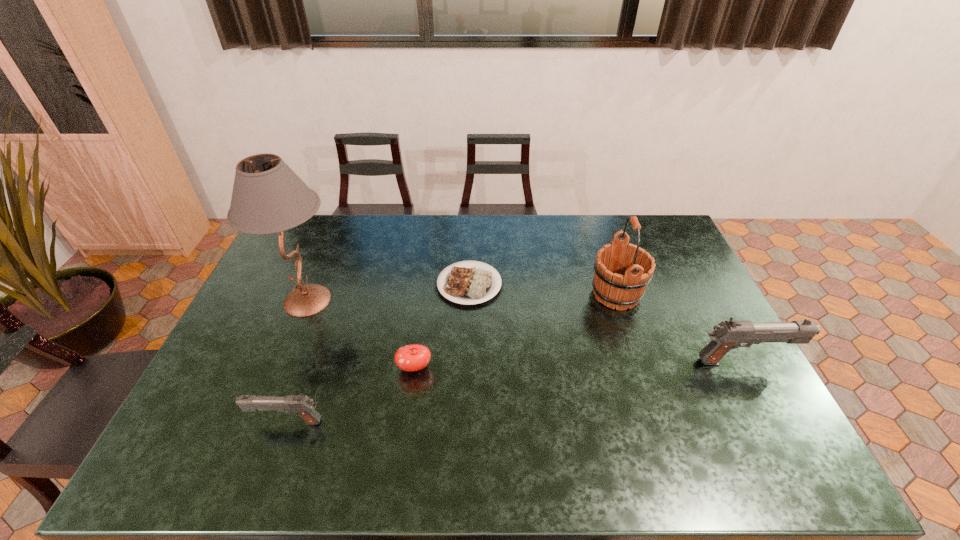
This screenshot has width=960, height=540. I want to click on vacant area that lies between the nearest object and the farther gun, so click(516, 392).

Locate an element on the screen. unoccupied position between the right gun and the shortest object is located at coordinates (607, 323).

Locate an element on the screen. free space between the shortest object and the second shortest object is located at coordinates (442, 326).

Locate an element on the screen. The height and width of the screenshot is (540, 960). free space between the shortest object and the second tallest object is located at coordinates point(542,289).

At what (x,y) coordinates should I click in order to perform the action: click on object that can be found as the fourth closest to the shortest object. Please return your answer as a coordinate pair (x, y). The width and height of the screenshot is (960, 540). Looking at the image, I should click on (302, 405).

Select which object is the second closest to the tallest object. Please provide its 2D coordinates. Your answer should be formatted as a tuple, i.e. [(x, y)], where the tuple contains the x and y coordinates of a point satisfying the conditions above.

[(469, 285)]